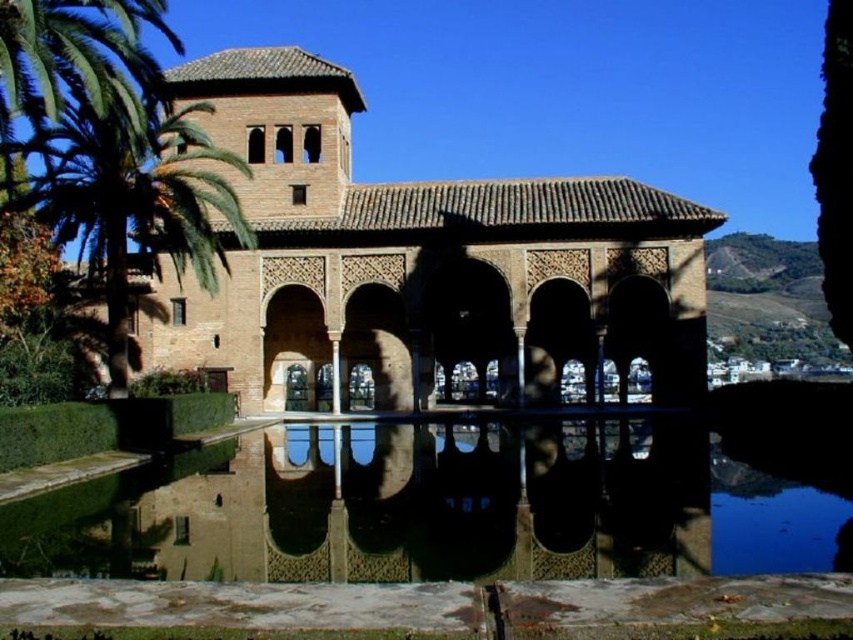
Is clear glass water at center smaller than green leafy palm tree at upper left?

Yes.

Which is in front, point (288, 552) or point (155, 147)?

Point (288, 552) is more forward.

The image size is (853, 640). What are the coordinates of `clear glass water at center` in the screenshot? It's located at (433, 508).